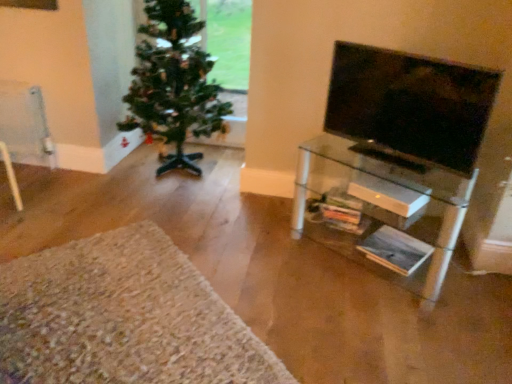
You are a GUI agent. You are given a task and a screenshot of the screen. Output one action in this format:
    pyautogui.click(x=<x>, y=<y>)
    Task: Click on the free spot to the right of white shaggy rug at lower left
    The height and width of the screenshot is (384, 512).
    Given the screenshot: What is the action you would take?
    pyautogui.click(x=332, y=306)